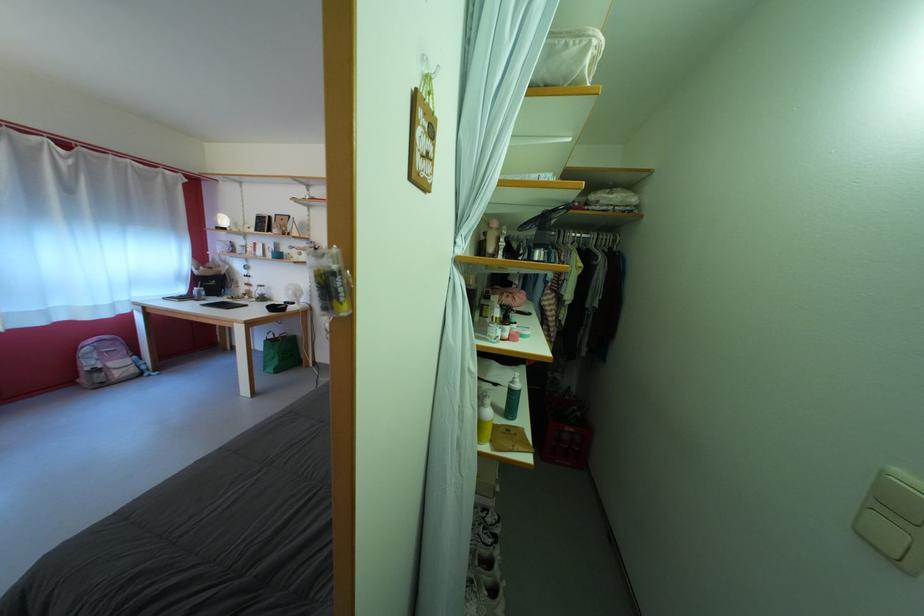
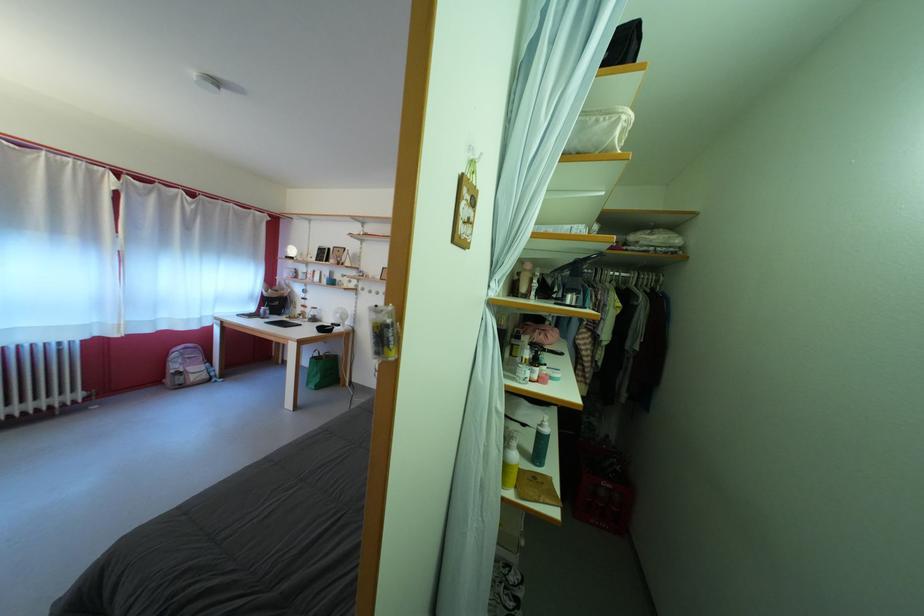
In the second image, find the point that corresponds to (263,336) in the first image.

(313, 353)